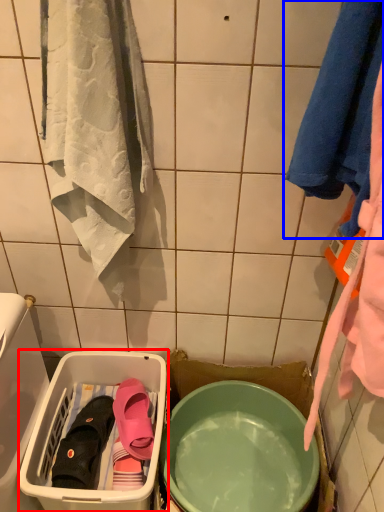
Question: Which object appears farthest to the camera in this image, laundry basket (highlighted by a red box) or towel (highlighted by a blue box)?

Choices:
 (A) laundry basket
 (B) towel

Answer: (A)